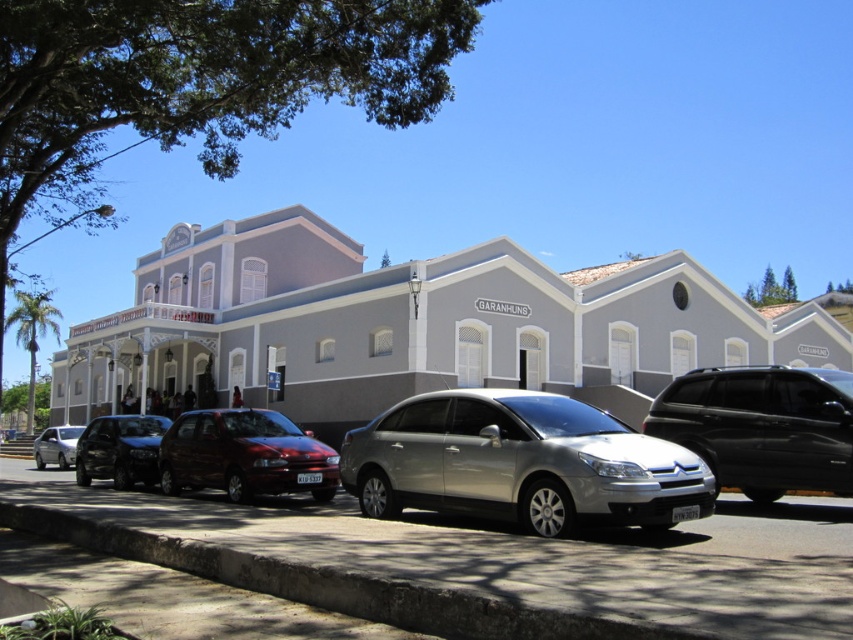
Question: Which point is closer to the camera?

Choices:
 (A) matte red hatchback at center
 (B) satin silver sedan at center
 (C) black glossy suv at center
 (D) white painted building at center

Answer: (C)

Question: Which point is farther to the camera?

Choices:
 (A) (86, 413)
 (B) (86, 456)

Answer: (A)

Question: Can you confirm if white painted building at center is positioned above matte silver sedan at lower left?

Choices:
 (A) yes
 (B) no

Answer: (A)

Question: From the image, what is the correct spatial relationship of white painted building at center in relation to matte silver sedan at lower left?

Choices:
 (A) right
 (B) left

Answer: (A)

Question: Which of the following is the closest to the observer?

Choices:
 (A) (114, 460)
 (B) (258, 461)
 (C) (49, 433)

Answer: (B)

Question: Does matte red hatchback at center lie in front of matte silver sedan at lower left?

Choices:
 (A) no
 (B) yes

Answer: (B)